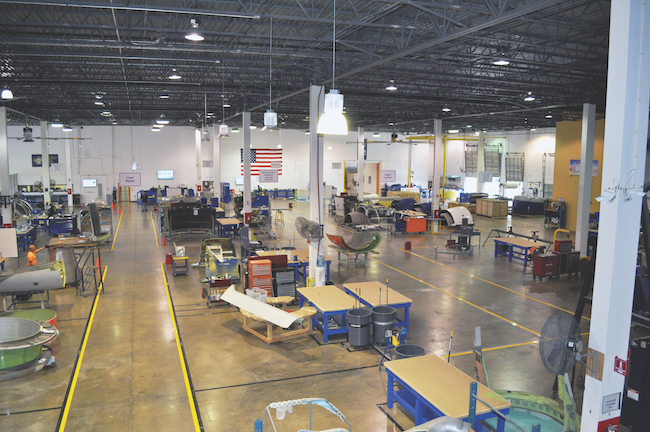
Locate an element on the screen. Image resolution: width=650 pixels, height=432 pixels. trashcan is located at coordinates 363,330.